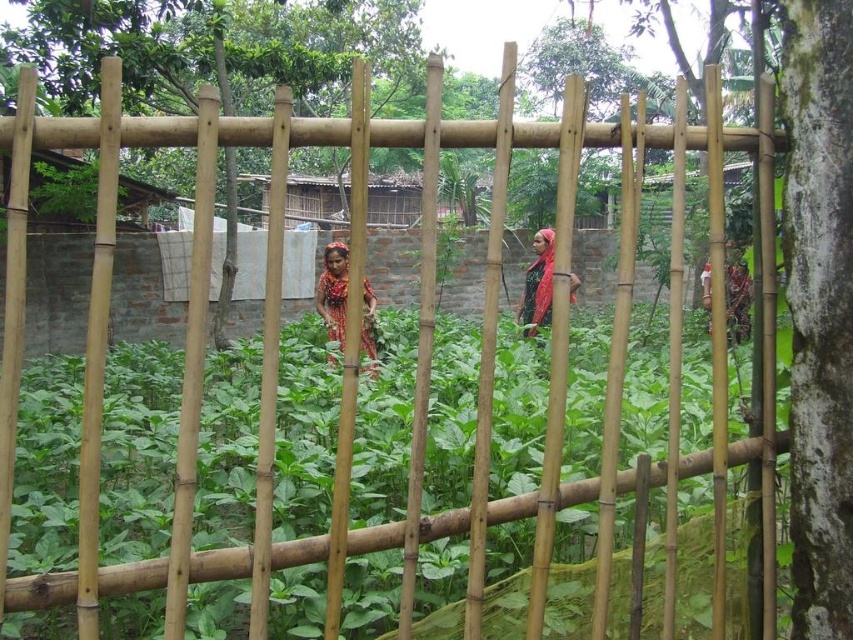
Is printed fabric dress at center to the right of matte green fabric at right from the viewer's perspective?

No, printed fabric dress at center is not to the right of matte green fabric at right.

Measure the distance between printed fabric dress at center and camera.

The distance of printed fabric dress at center from camera is 6.01 meters.

The image size is (853, 640). I want to click on printed fabric dress at center, so click(x=334, y=291).

Between point (325, 304) and point (537, 323), which one is positioned in front?

Point (325, 304) is more forward.

Can you confirm if printed fabric dress at center is smaller than red fabric headscarf at center?

Correct, printed fabric dress at center occupies less space than red fabric headscarf at center.

Between point (370, 332) and point (532, 332), which one is positioned in front?

Positioned in front is point (370, 332).

The image size is (853, 640). What are the coordinates of `printed fabric dress at center` in the screenshot? It's located at (334, 291).

How far apart are red fabric headscarf at center and matte green fabric at right?

5.84 feet

Measure the distance between point (527, 298) and camera.

They are 26.05 feet apart.

Locate an element on the screen. red fabric headscarf at center is located at coordinates (538, 284).